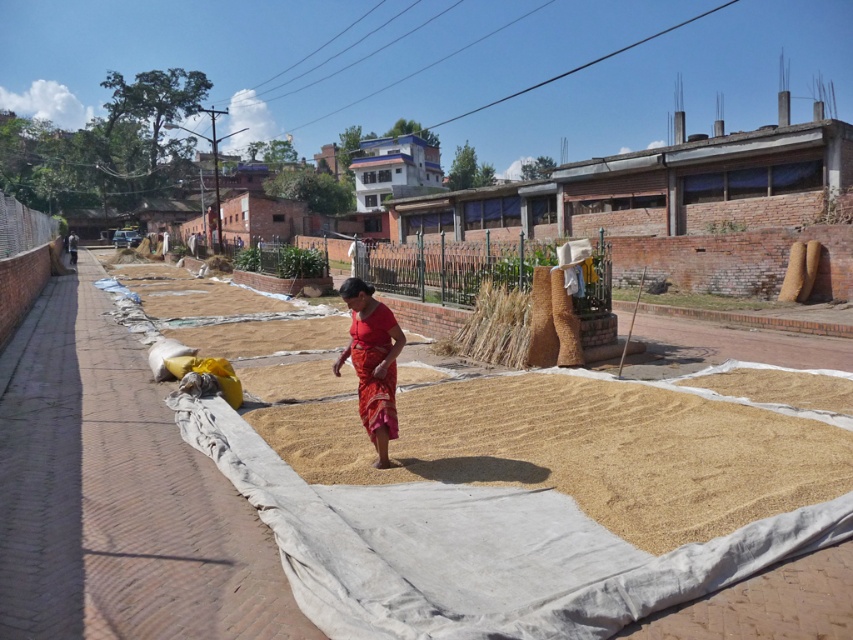
Who is lower down, brown grain at center or brown straw at center?

brown grain at center is lower down.

In the scene shown: Which of these two, brown grain at center or brown straw at center, stands shorter?

Standing shorter between the two is brown grain at center.

Who is more distant from viewer, (x=538, y=392) or (x=444, y=340)?

The point (x=444, y=340) is behind.

At what (x,y) coordinates should I click in order to perform the action: click on brown grain at center. Please return your answer as a coordinate pair (x, y). This screenshot has height=640, width=853. Looking at the image, I should click on tap(584, 451).

Is red cotton saree at center to the right of brown straw at center from the viewer's perspective?

Incorrect, red cotton saree at center is not on the right side of brown straw at center.

Who is lower down, red cotton saree at center or brown straw at center?

red cotton saree at center

This screenshot has width=853, height=640. I want to click on red cotton saree at center, so click(372, 362).

The height and width of the screenshot is (640, 853). What are the coordinates of `red cotton saree at center` in the screenshot? It's located at (372, 362).

Does brown grain at center appear on the right side of red cotton saree at center?

Indeed, brown grain at center is positioned on the right side of red cotton saree at center.

Does brown grain at center appear on the left side of red cotton saree at center?

No, brown grain at center is not to the left of red cotton saree at center.

Is point (585, 429) less distant than point (376, 352)?

No.

This screenshot has height=640, width=853. In order to click on brown grain at center in this screenshot , I will do `click(584, 451)`.